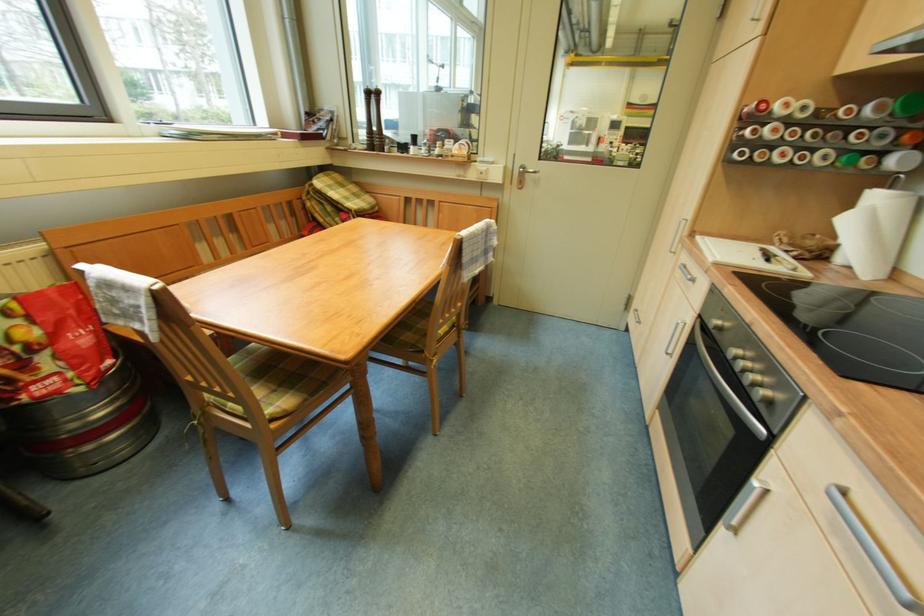
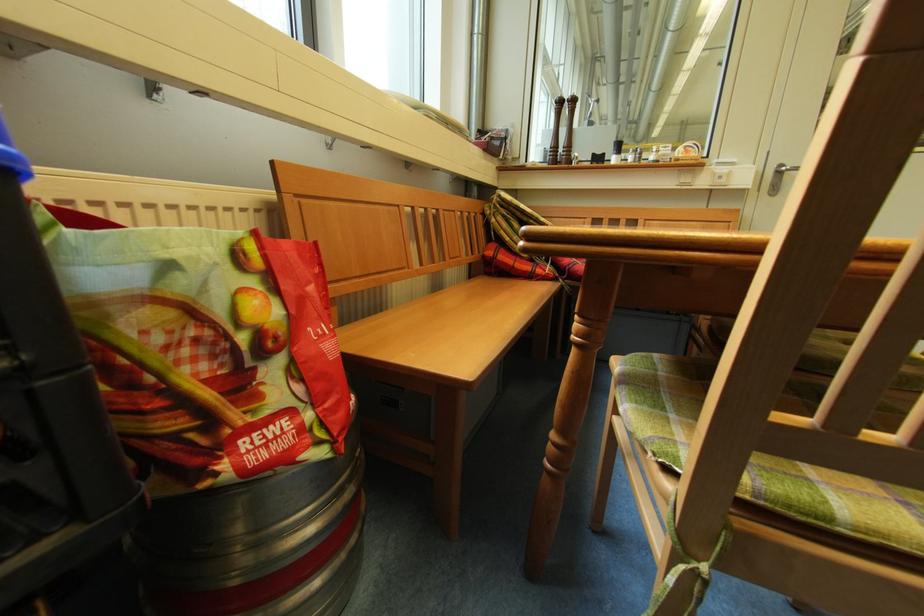
Locate, in the second image, the point that corresponds to pixel 375 137 in the first image.

(558, 151)